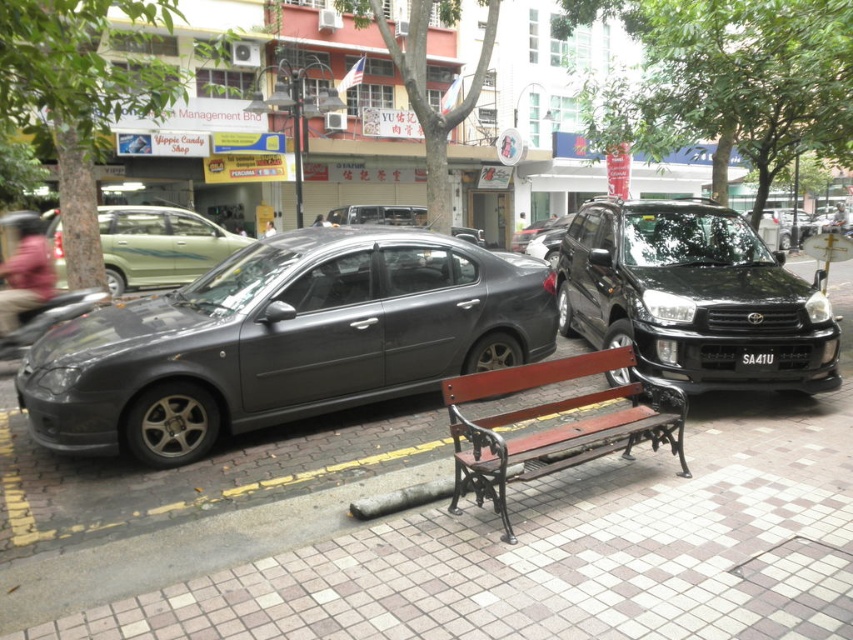
Is brown tile pavement at center to the right of wooden bench at center from the viewer's perspective?

Incorrect, brown tile pavement at center is not on the right side of wooden bench at center.

In order to click on brown tile pavement at center in this screenshot , I will do `click(486, 552)`.

Does matte gray sedan at center-left appear on the right side of black plastic license plate at center?

No, matte gray sedan at center-left is not to the right of black plastic license plate at center.

Does point (189, 321) come farther from viewer compared to point (764, 362)?

That is False.

Locate an element on the screen. matte gray sedan at center-left is located at coordinates (283, 340).

Is matte gray sedan at center-left to the left of black metallic sedan at right from the viewer's perspective?

Indeed, matte gray sedan at center-left is positioned on the left side of black metallic sedan at right.

Can you confirm if matte gray sedan at center-left is smaller than black metallic sedan at right?

No, matte gray sedan at center-left is not smaller than black metallic sedan at right.

Identify the location of matte gray sedan at center-left. (283, 340).